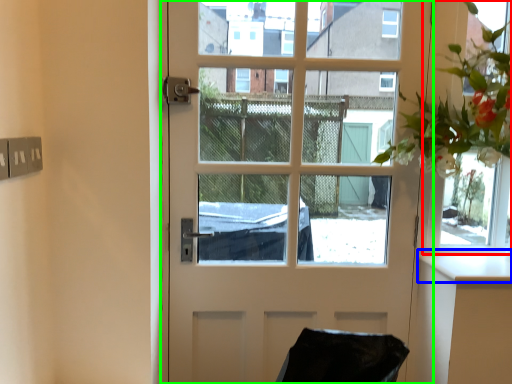
Question: Considering the real-world distances, which object is farthest from window frame (highlighted by a red box)? counter top (highlighted by a blue box) or door (highlighted by a green box)?

Choices:
 (A) counter top
 (B) door

Answer: (B)